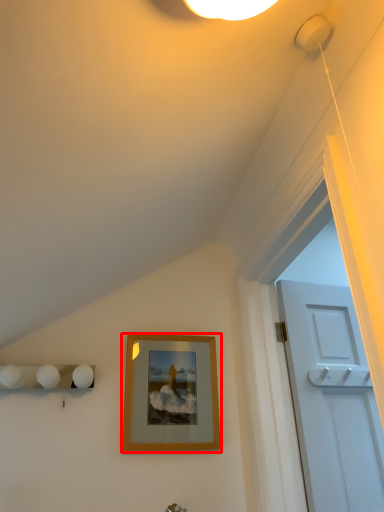
Question: Observing the image, what is the correct spatial positioning of picture frame (annotated by the red box) in reference to door handle?

Choices:
 (A) left
 (B) right

Answer: (A)